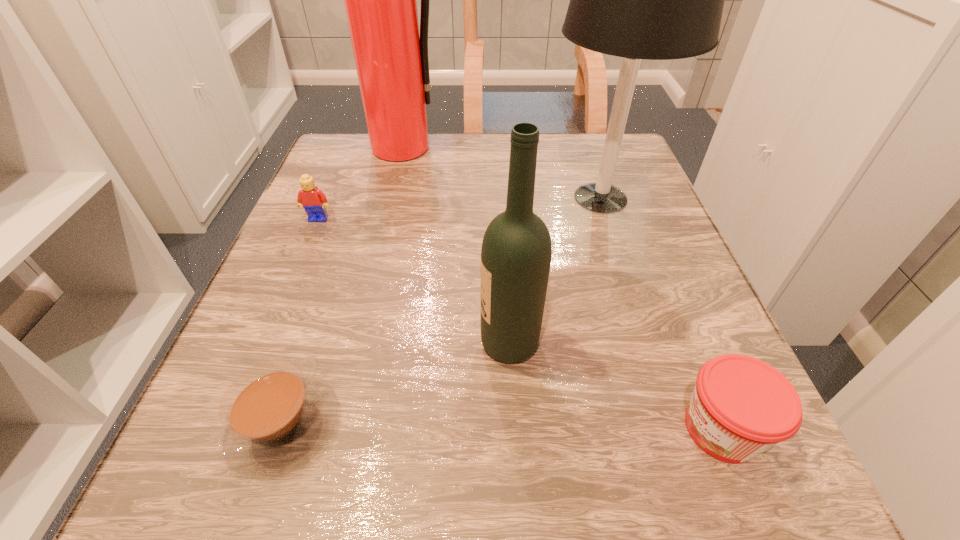
Locate an element on the screen. The image size is (960, 540). vacant space at the far edge of the desktop is located at coordinates (432, 180).

The height and width of the screenshot is (540, 960). I want to click on blank space at the near edge, so click(438, 471).

This screenshot has height=540, width=960. Find the location of `free region at the left edge`. free region at the left edge is located at coordinates (219, 374).

The width and height of the screenshot is (960, 540). Identify the location of vacant area at the right edge. (619, 265).

The width and height of the screenshot is (960, 540). What are the coordinates of `vacant space at the far right corner of the desktop` in the screenshot? It's located at (603, 147).

Where is `free space at the near right corner`? Image resolution: width=960 pixels, height=540 pixels. free space at the near right corner is located at coordinates (714, 463).

I want to click on free spot between the table lamp and the Lego, so click(x=460, y=208).

Locate an element on the screen. vacant region between the table lamp and the jam is located at coordinates (661, 313).

Locate an element on the screen. The width and height of the screenshot is (960, 540). free space between the farthest object and the jam is located at coordinates pyautogui.click(x=563, y=288).

The width and height of the screenshot is (960, 540). Identify the location of free space between the fourth object from left to right and the table lamp. (555, 271).